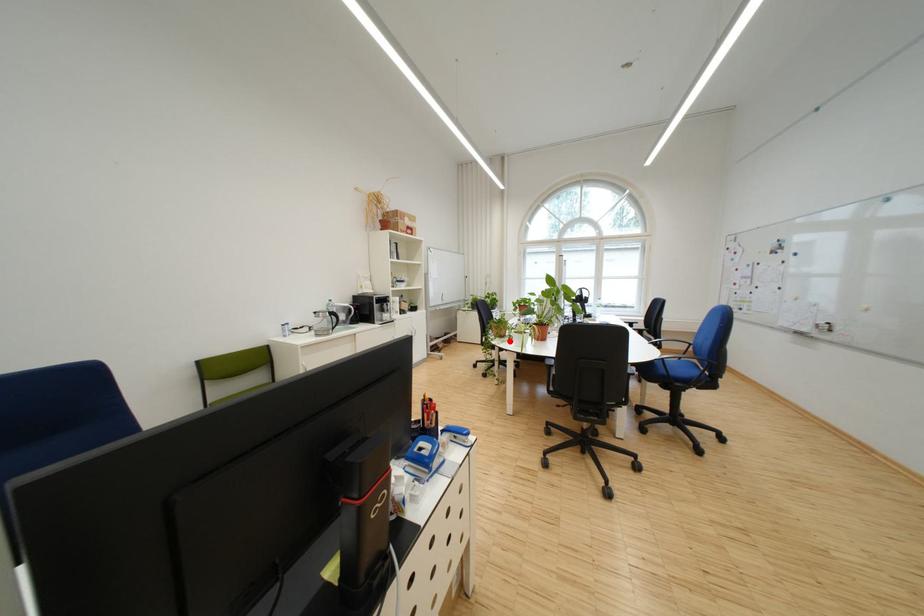
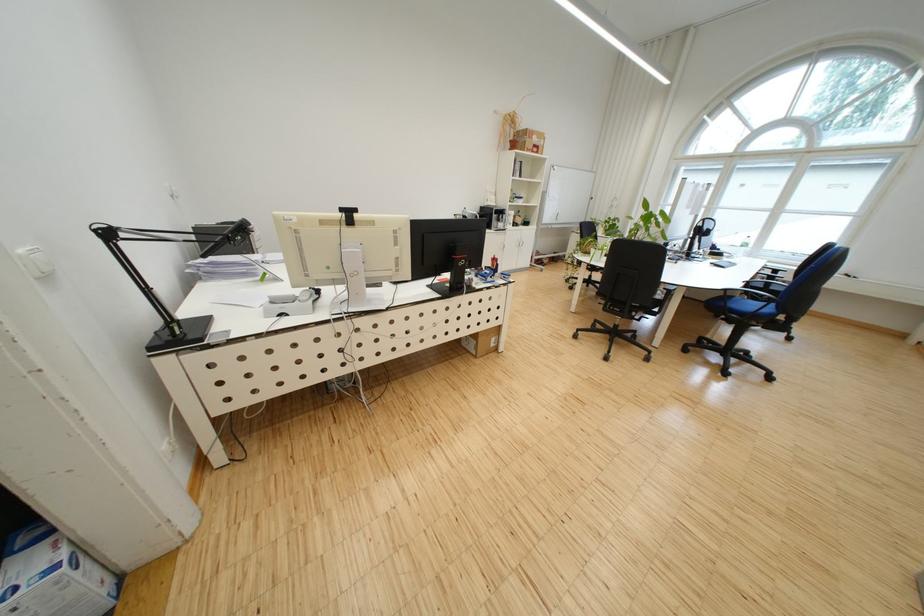
The point at the highlighted location is marked in the first image. Where is the corresponding point in the second image?

(592, 256)